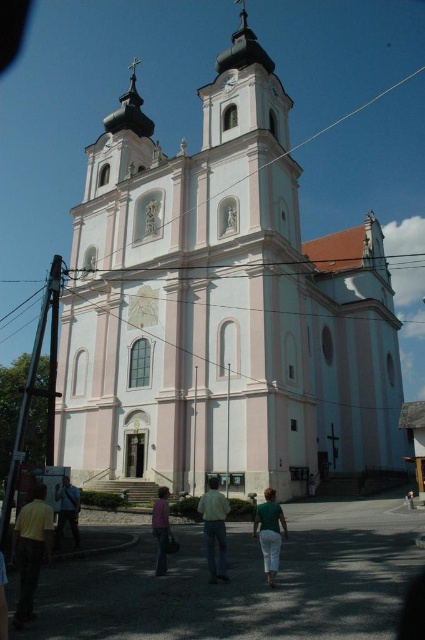
Question: Which point is closer to the camera?

Choices:
 (A) light blue jeans at lower left
 (B) light blue jeans at center
 (C) pink smooth church at center

Answer: (B)

Question: Does dark brown leather pants at lower left appear over light blue jeans at lower left?

Choices:
 (A) yes
 (B) no

Answer: (A)

Question: Among these points, which one is farthest from the camera?

Choices:
 (A) (263, 513)
 (B) (161, 538)

Answer: (B)

Question: Is pink smooth church at center to the right of pink fabric shirt at center from the viewer's perspective?

Choices:
 (A) no
 (B) yes

Answer: (B)

Question: Does pink smooth church at center appear on the left side of dark brown leather pants at lower left?

Choices:
 (A) no
 (B) yes

Answer: (A)

Question: Among these objects, which one is nearest to the camera?

Choices:
 (A) pink fabric shirt at center
 (B) pink smooth church at center

Answer: (A)